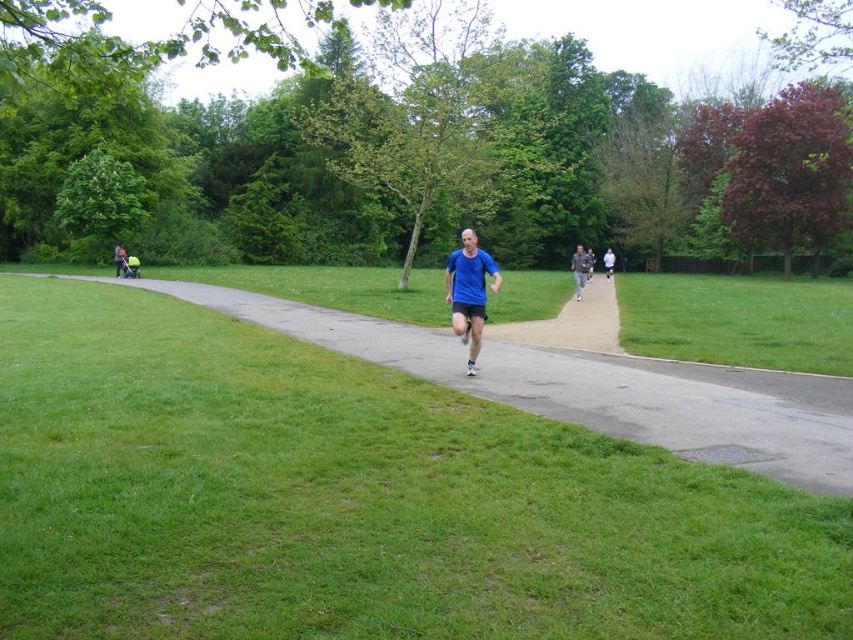
Which is behind, point (581, 244) or point (590, 266)?

Positioned behind is point (581, 244).

Who is more distant from viewer, [584,276] or [590,250]?

The point [590,250] is more distant.

Where is `dark gray jacket at center`? dark gray jacket at center is located at coordinates (579, 269).

Is green grass at lower left wider than green grass at lower right?

No.

Does point (344, 353) come closer to viewer compared to point (664, 284)?

Yes, it is in front of point (664, 284).

Locate an element on the screen. The image size is (853, 640). green grass at lower left is located at coordinates click(590, 387).

From the picture: Which of these two, green grass at lower right or blue fabric shirt at center, stands shorter?

With less height is green grass at lower right.

Is point (656, 291) more distant than point (589, 272)?

Yes, it is.

Which is in front, point (635, 316) or point (592, 269)?

Point (635, 316)

Find the location of a particular element. green grass at lower right is located at coordinates (738, 321).